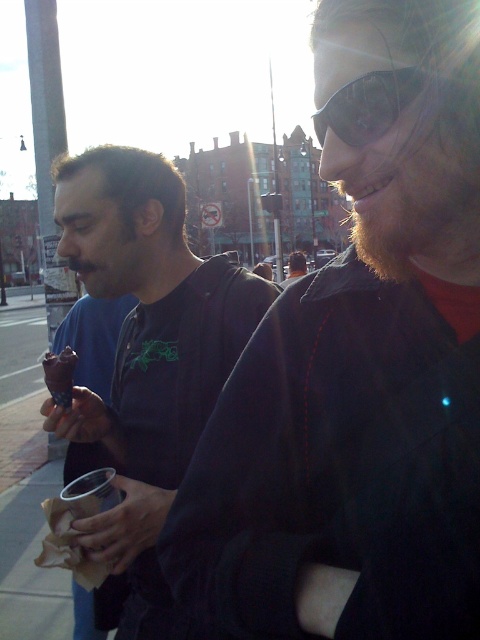
Question: Does matte black jacket at left appear over sunglasses at upper right?

Choices:
 (A) no
 (B) yes

Answer: (A)

Question: Among these objects, which one is nearest to the camera?

Choices:
 (A) matte black jacket at center
 (B) matte black jacket at left

Answer: (B)

Question: Among these objects, which one is farthest from the camera?

Choices:
 (A) black matte jacket at center
 (B) chocolate ice cream at lower left
 (C) sunglasses at upper right

Answer: (B)

Question: Which object is farther from the camera taking this photo?

Choices:
 (A) sunglasses at upper right
 (B) black matte jacket at center
 (C) matte black jacket at left

Answer: (C)

Question: Is the position of black matte jacket at center more distant than that of matte black jacket at left?

Choices:
 (A) no
 (B) yes

Answer: (A)

Question: Does sunglasses at upper right appear over chocolate ice cream at lower left?

Choices:
 (A) no
 (B) yes

Answer: (B)